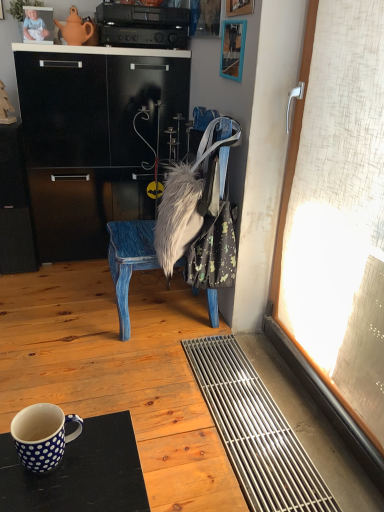
Question: Is fuzzy fabric bag at center shorter than brushed metal picture frame at upper center, which ranks as the 1th picture frame in top-to-bottom order?

Choices:
 (A) no
 (B) yes

Answer: (A)

Question: From a real-world perspective, does fuzzy fabric bag at center stand above brushed metal picture frame at upper center, positioned as the 3th picture frame in bottom-to-top order?

Choices:
 (A) yes
 (B) no

Answer: (B)

Question: Does fuzzy fabric bag at center have a greater width compared to brushed metal picture frame at upper center, which ranks as the 1th picture frame in top-to-bottom order?

Choices:
 (A) no
 (B) yes

Answer: (B)

Question: Is brushed metal picture frame at upper center, which ranks as the 1th picture frame in top-to-bottom order, located within fuzzy fabric bag at center?

Choices:
 (A) no
 (B) yes

Answer: (A)

Question: Considering the relative positions of fuzzy fabric bag at center and brushed metal picture frame at upper center, the 1th picture frame from the back, in the image provided, is fuzzy fabric bag at center to the right of brushed metal picture frame at upper center, the 1th picture frame from the back, from the viewer's perspective?

Choices:
 (A) no
 (B) yes

Answer: (B)

Question: Looking at the image, does white polka dot ceramic mug at lower left seem bigger or smaller compared to brushed metal picture frame at upper center, positioned as the 3th picture frame in bottom-to-top order?

Choices:
 (A) small
 (B) big

Answer: (A)

Question: Relative to brushed metal picture frame at upper center, placed as the third picture frame when sorted from front to back, is white polka dot ceramic mug at lower left in front or behind?

Choices:
 (A) front
 (B) behind

Answer: (A)

Question: Is white polka dot ceramic mug at lower left situated inside brushed metal picture frame at upper center, the 1th picture frame from the back, or outside?

Choices:
 (A) inside
 (B) outside

Answer: (B)

Question: Is point (62, 421) closer or farther from the camera than point (0, 11)?

Choices:
 (A) farther
 (B) closer

Answer: (B)

Question: From a real-world perspective, is blue painted wood chair at center positioned above or below fuzzy white fur at center?

Choices:
 (A) below
 (B) above

Answer: (B)

Question: Considering their positions, is blue painted wood chair at center located in front of or behind fuzzy white fur at center?

Choices:
 (A) front
 (B) behind

Answer: (A)

Question: Considering the positions of point (216, 204) and point (196, 224), is point (216, 204) closer or farther from the camera than point (196, 224)?

Choices:
 (A) closer
 (B) farther

Answer: (B)

Question: Based on their sizes in the image, would you say blue painted wood chair at center is bigger or smaller than fuzzy white fur at center?

Choices:
 (A) small
 (B) big

Answer: (B)

Question: From the image's perspective, is fuzzy white fur at center located above or below brushed metal picture frame at upper center, the 1th picture frame from the back?

Choices:
 (A) above
 (B) below

Answer: (B)

Question: From a real-world perspective, is fuzzy white fur at center physically located above or below brushed metal picture frame at upper center, placed as the third picture frame when sorted from front to back?

Choices:
 (A) below
 (B) above

Answer: (A)